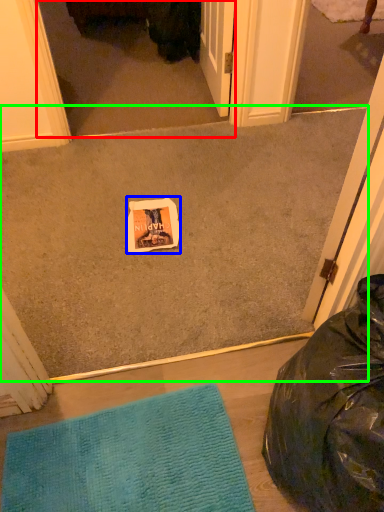
Question: Based on their relative distances, which object is farther from screen door (highlighted by a red box)? Choose from postcard (highlighted by a blue box) and concrete (highlighted by a green box).

Choices:
 (A) postcard
 (B) concrete

Answer: (A)